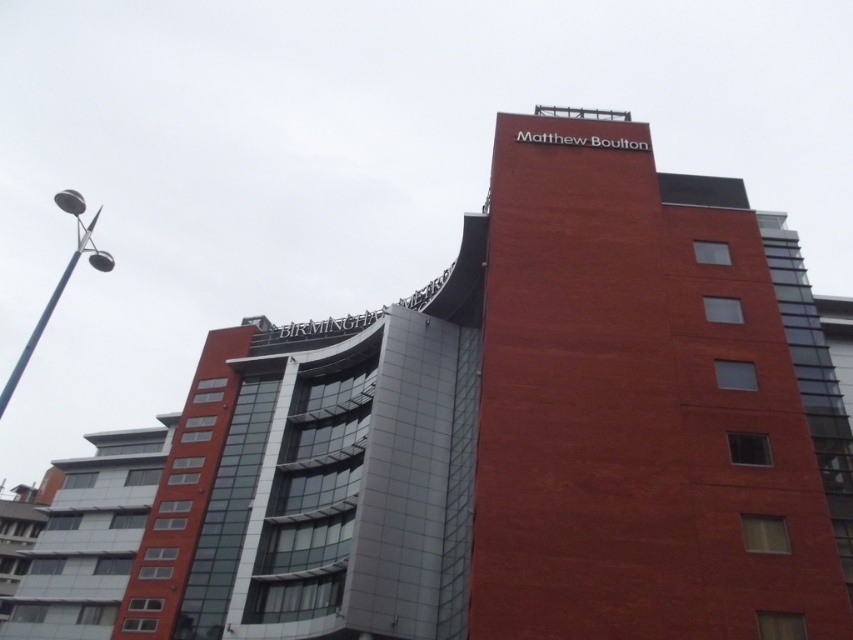
Is red brick building at center to the left of black metal pole at upper left from the viewer's perspective?

No, red brick building at center is not to the left of black metal pole at upper left.

Is point (624, 211) positioned after point (9, 397)?

No.

Which is in front, point (647, 568) or point (108, 266)?

Point (647, 568) is more forward.

This screenshot has height=640, width=853. Identify the location of red brick building at center. (525, 429).